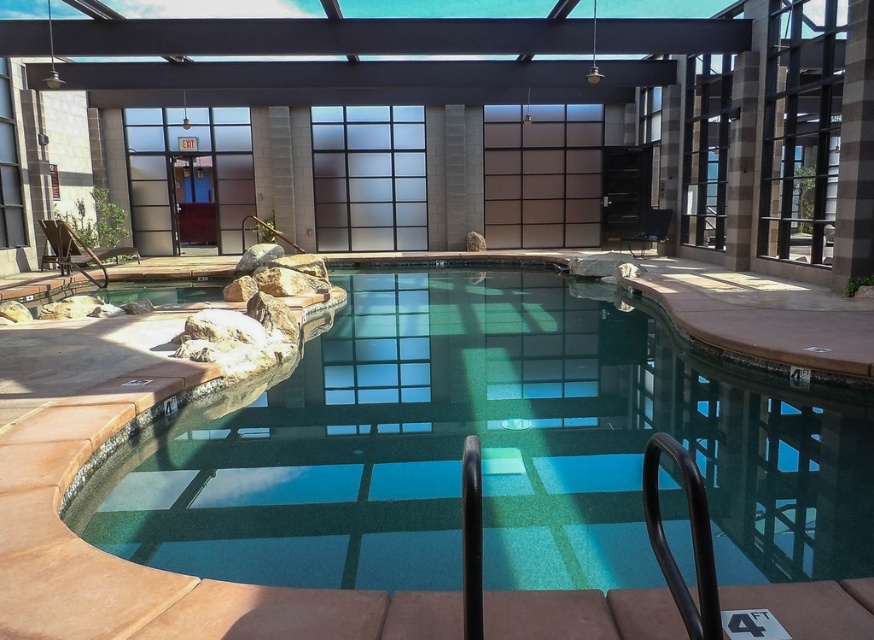
You are a visitor standing at the entrance of the indoor pool area. You want to see the green tile swimming pool at center through the transparent glass pool at center. Is this possible?

The green tile swimming pool at center is behind the transparent glass pool at center, so yes, you can see the green tile swimming pool at center through the transparent glass pool at center since the glass is transparent.

You are standing at the entrance of the swimming pool area and want to locate the transparent glass pool at center. According to the coordinates provided, where should you look relative to your position?

The transparent glass pool at center is located at point coordinates, so you should look towards the lower left direction from your current position at the entrance.

Consider the image. You are a lifeguard standing on the deck and see the transparent glass pool at center and the green tile swimming pool at center. Which one is closer to the ceiling?

The transparent glass pool at center is above the green tile swimming pool at center, so it is closer to the ceiling.